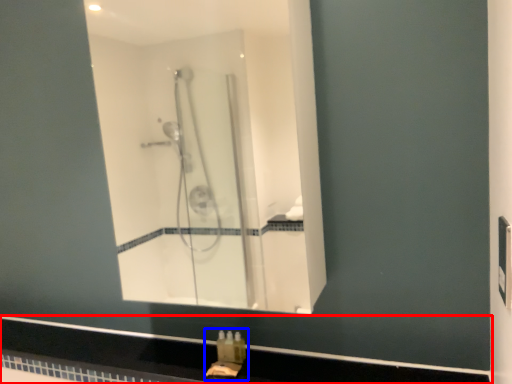
Question: Which object appears closest to the camera in this image, counter top (highlighted by a red box) or sink (highlighted by a blue box)?

Choices:
 (A) counter top
 (B) sink

Answer: (A)